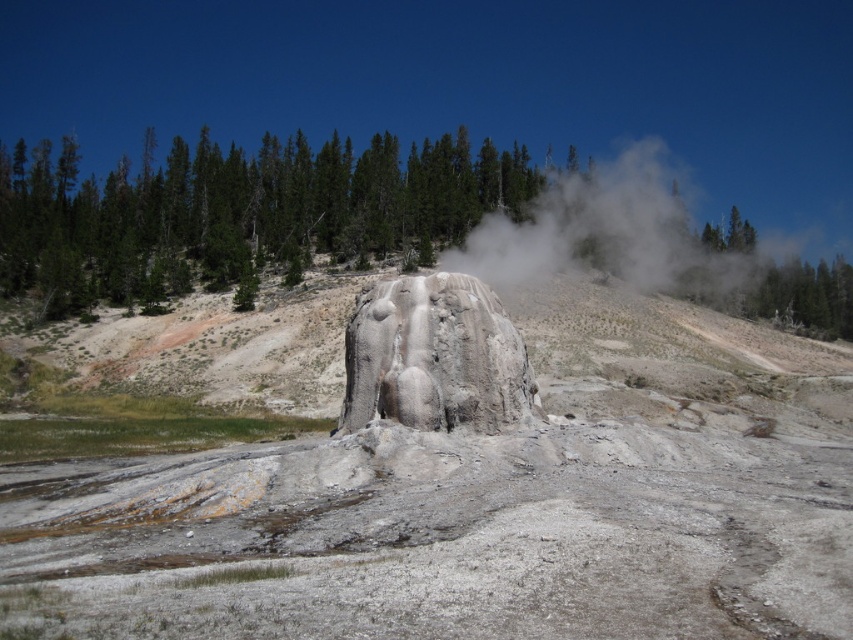
Is green textured trees at upper center thinner than white vapor at center?

No.

Can you confirm if green textured trees at upper center is positioned to the right of white vapor at center?

In fact, green textured trees at upper center is to the left of white vapor at center.

Who is more forward, (x=463, y=225) or (x=532, y=234)?

Point (x=532, y=234)

Locate an element on the screen. green textured trees at upper center is located at coordinates [238, 212].

Who is lower down, gray rock formation at center or white vapor at center?

gray rock formation at center is below.

Is gray rock formation at center smaller than white vapor at center?

Yes, gray rock formation at center is smaller than white vapor at center.

Is point (614, 289) farther from camera compared to point (756, 276)?

No, it is in front of (756, 276).

At what (x,y) coordinates should I click in order to perform the action: click on gray rock formation at center. Please return your answer as a coordinate pair (x, y). The height and width of the screenshot is (640, 853). Looking at the image, I should click on (213, 346).

Does point (498, 636) come closer to viewer compared to point (546, 202)?

Yes.

At what (x,y) coordinates should I click in order to perform the action: click on gray/rough rock formation at center. Please return your answer as a coordinate pair (x, y). Image resolution: width=853 pixels, height=640 pixels. Looking at the image, I should click on (485, 504).

Identify the location of gray/rough rock formation at center. The image size is (853, 640). (485, 504).